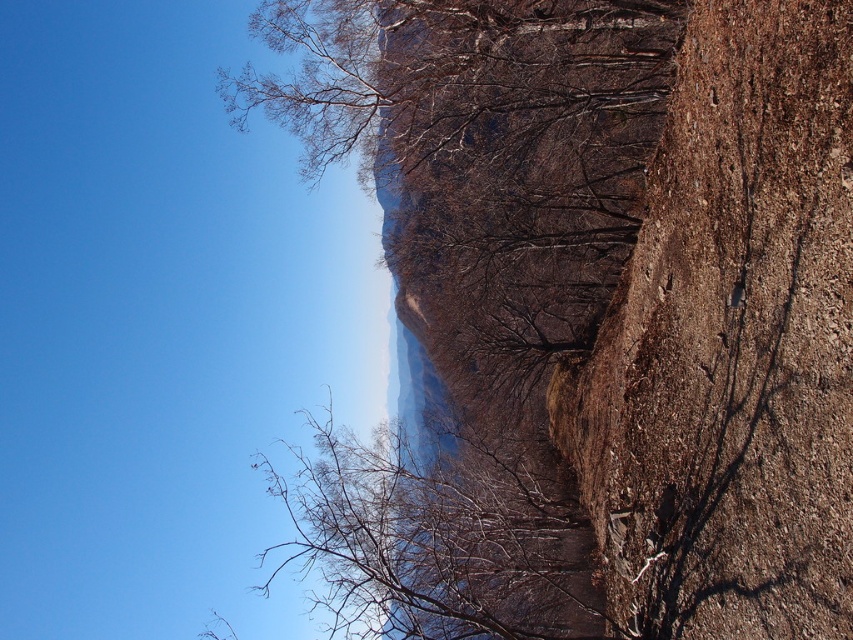
Is point (815, 108) positioned in front of point (456, 579)?

Yes, point (815, 108) is closer to viewer.

Image resolution: width=853 pixels, height=640 pixels. Describe the element at coordinates (730, 344) in the screenshot. I see `brown rough rock at right` at that location.

Where is `brown rough rock at right`? The image size is (853, 640). brown rough rock at right is located at coordinates (730, 344).